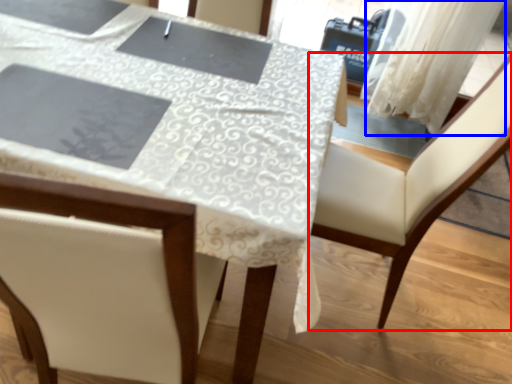
Question: Which of the following is the farthest to the observer, chair (highlighted by a red box) or curtain (highlighted by a blue box)?

Choices:
 (A) chair
 (B) curtain

Answer: (B)